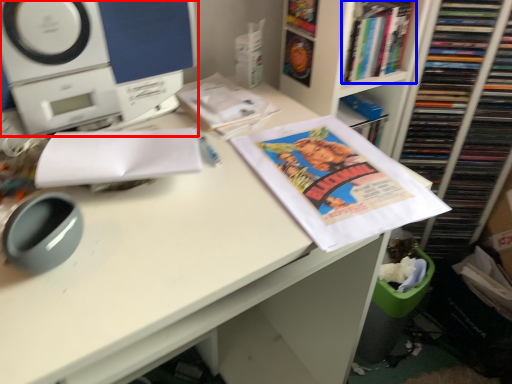
Question: Which object appears closest to the camera in this image, home appliance (highlighted by a red box) or book (highlighted by a blue box)?

Choices:
 (A) home appliance
 (B) book

Answer: (A)